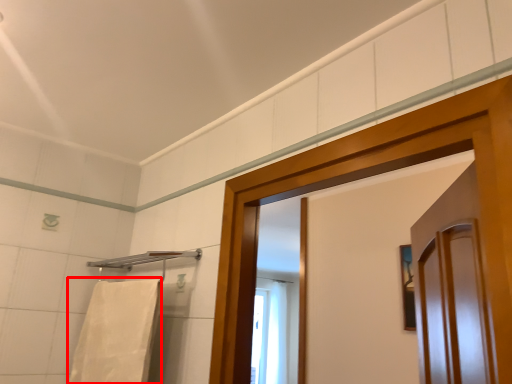
Question: From the image, what is the correct spatial relationship of bath towel (annotated by the red box) in relation to towel bar?

Choices:
 (A) left
 (B) right

Answer: (A)